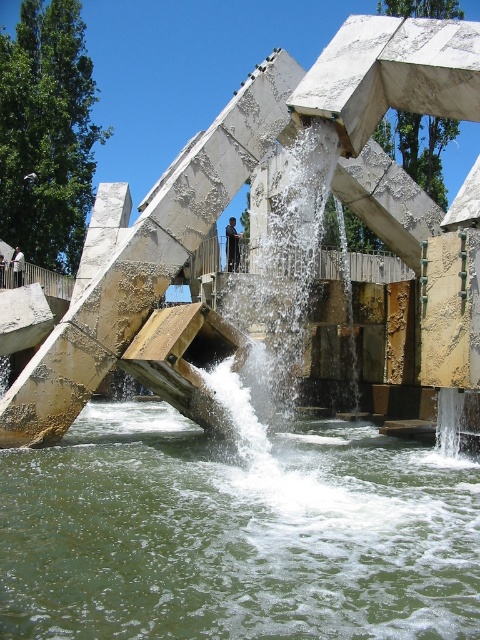
Is greenish water at center bottom thinner than white concrete dam at center?

Yes, greenish water at center bottom is thinner than white concrete dam at center.

Does greenish water at center bottom appear over white concrete dam at center?

Actually, greenish water at center bottom is below white concrete dam at center.

Between point (44, 552) and point (82, 403), which one is positioned behind?

Positioned behind is point (82, 403).

The image size is (480, 640). Find the location of `greenish water at center bottom`. greenish water at center bottom is located at coordinates (236, 531).

Between point (435, 468) and point (17, 275), which one is positioned behind?

Positioned behind is point (17, 275).

Which of these two, greenish water at center bottom or dark blue jeans at left, stands shorter?

Standing shorter between the two is greenish water at center bottom.

Is point (252, 540) positioned in front of point (21, 284)?

Yes.

The image size is (480, 640). I want to click on greenish water at center bottom, so click(x=236, y=531).

Based on the photo, which of these two, white concrete dam at center or dark blue shirt at center, stands shorter?

With less height is dark blue shirt at center.

Does white concrete dam at center appear over dark blue shirt at center?

Actually, white concrete dam at center is below dark blue shirt at center.

Between point (336, 129) and point (229, 237), which one is positioned behind?

Point (229, 237)

You are a GUI agent. You are given a task and a screenshot of the screen. Output one action in this format:
    pyautogui.click(x=<x>, y=<y>)
    Task: Click on the white concrete dam at center
    The image size is (480, 640).
    Given the screenshot: What is the action you would take?
    pyautogui.click(x=238, y=188)